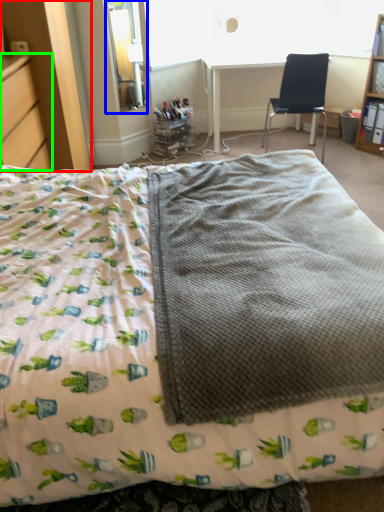
Question: Which object is positioned farthest from dresser (highlighted by a red box)? Select from window screen (highlighted by a blue box) and file cabinet (highlighted by a green box).

Choices:
 (A) window screen
 (B) file cabinet

Answer: (A)